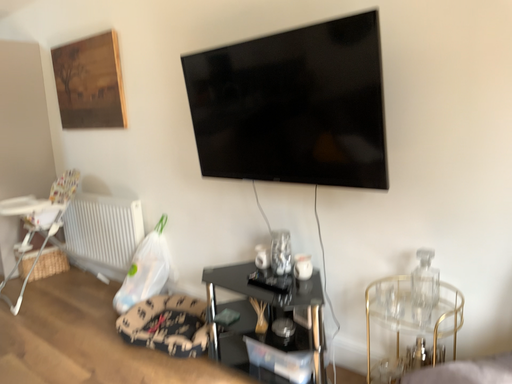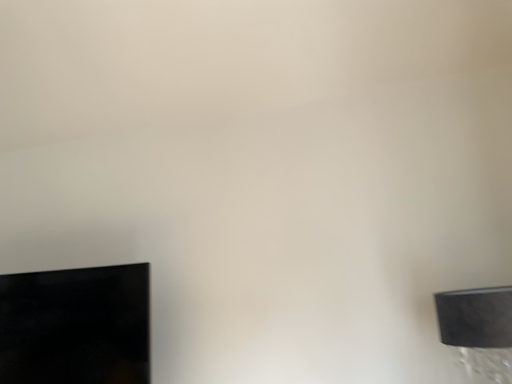
Question: How did the camera likely rotate when shooting the video?

Choices:
 (A) rotated upward
 (B) rotated downward

Answer: (A)